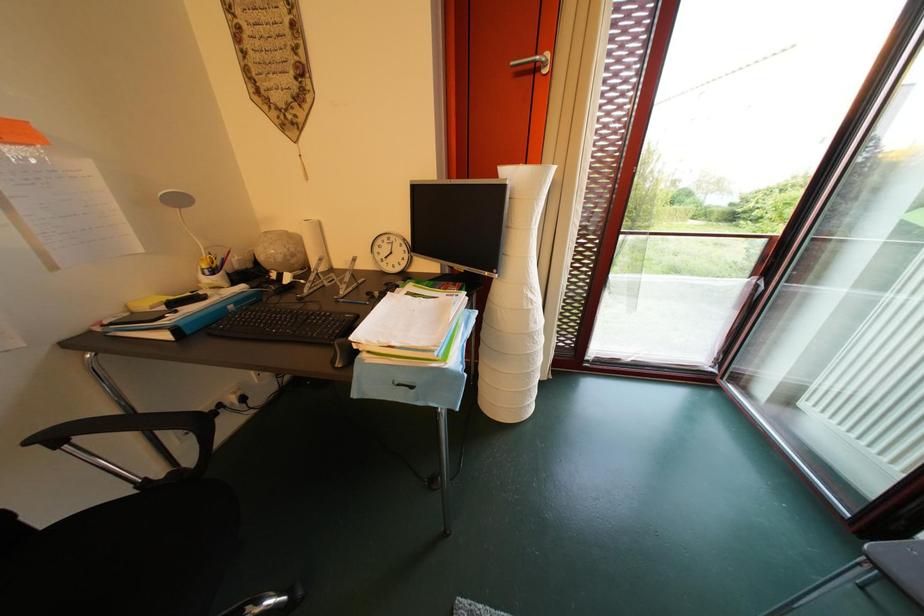
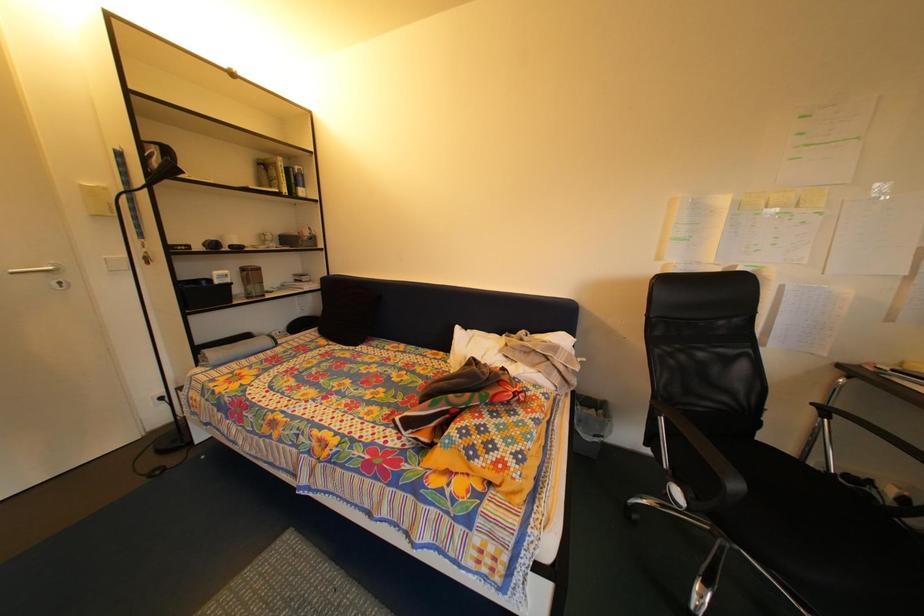
The first image is from the beginning of the video and the second image is from the end. How did the camera likely rotate when shooting the video?

The rotation direction of the camera is left-down.